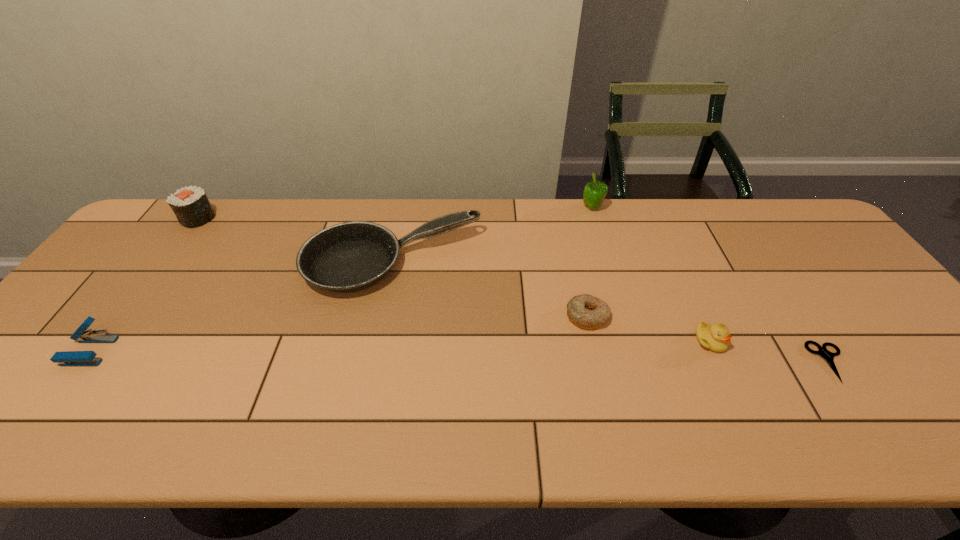
Image resolution: width=960 pixels, height=540 pixels. In order to click on bell pepper in this screenshot , I will do `click(594, 193)`.

Locate an element on the screen. This screenshot has width=960, height=540. the fifth object from left to right is located at coordinates point(594,193).

This screenshot has height=540, width=960. I want to click on sushi, so click(190, 205).

Identify the location of frying pan. This screenshot has height=540, width=960. (351, 256).

You are a GUI agent. You are given a task and a screenshot of the screen. Output one action in this format:
    pyautogui.click(x=<x>, y=<y>)
    Task: Click on the stapler
    This screenshot has height=540, width=960.
    Given the screenshot: What is the action you would take?
    pyautogui.click(x=67, y=358)

This screenshot has height=540, width=960. In order to click on duckling in this screenshot , I will do `click(716, 337)`.

Identify the location of the fifth tallest object. (716, 337).

I want to click on doughnut, so click(x=586, y=311).

At what (x,y) coordinates should I click in order to perform the action: click on the sixth tallest object. Please return your answer as a coordinate pair (x, y). Looking at the image, I should click on (586, 311).

Locate an element on the screen. the shortest object is located at coordinates (827, 355).